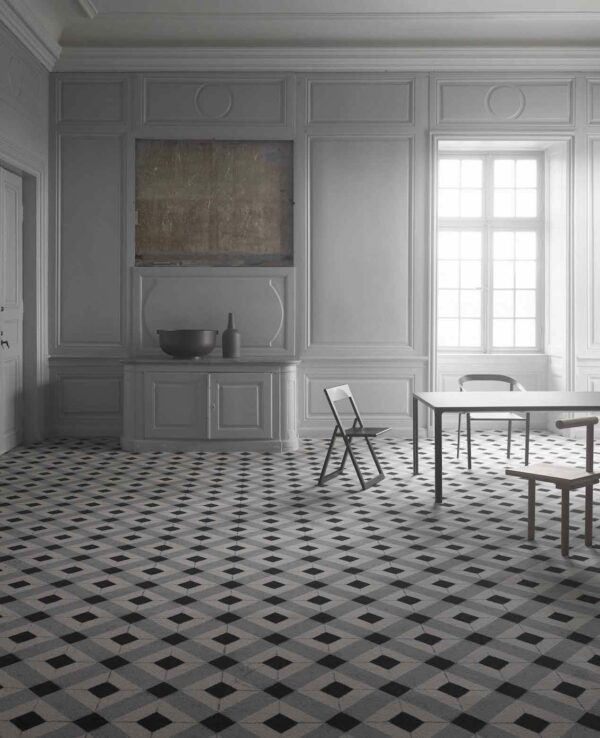
At what (x,y) coordinates should I click in order to perform the action: click on door handle. Please return your answer as a coordinate pair (x, y). This screenshot has height=738, width=600. Looking at the image, I should click on click(x=8, y=339).